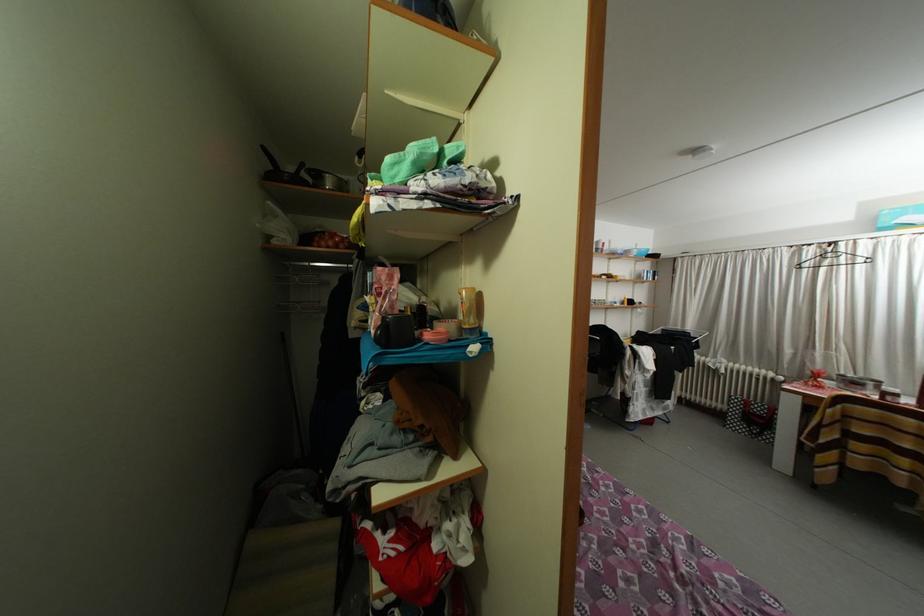
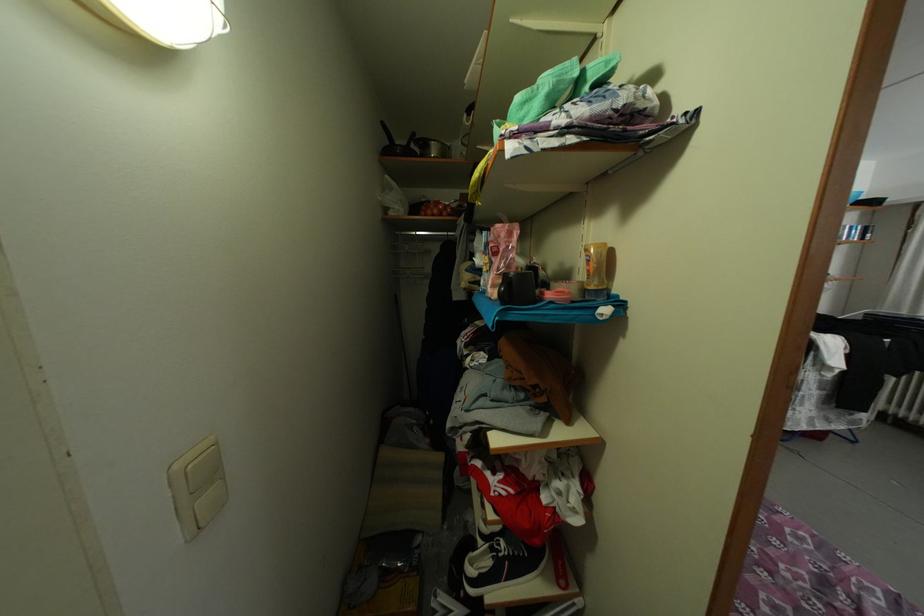
Find the pixel in the second image that matches point (472, 331) in the first image.

(598, 293)